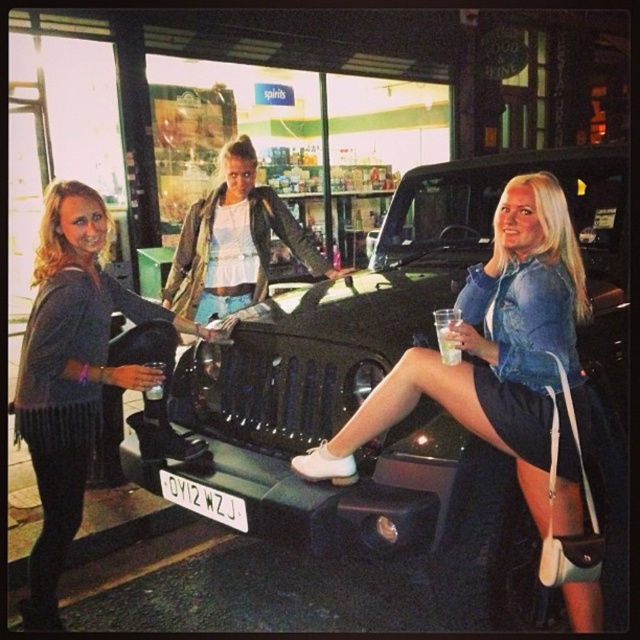
You are a delivery person who needs to park your van near the black matte car at center and the white plastic license plate at center. Based on their positions, which one should you avoid blocking when parking?

The white plastic license plate at center is below the black matte car at center, so you should avoid blocking the white plastic license plate at center to ensure it remains visible for parking regulations.

You are a customer at the gas station and want to choose a drink container. You have a preference for the larger one. Which object should you pick between the clear plastic cup at center and the clear plastic bottle at center?

The clear plastic bottle at center is larger than the clear plastic cup at center, so you should pick the clear plastic bottle at center.

You are standing at point (236,499) and want to move to point (196,250). Is the direction you need to move towards considered forward or backward?

The point (196,250) is behind point (236,499), so moving from (236,499) to (196,250) would be moving backward.